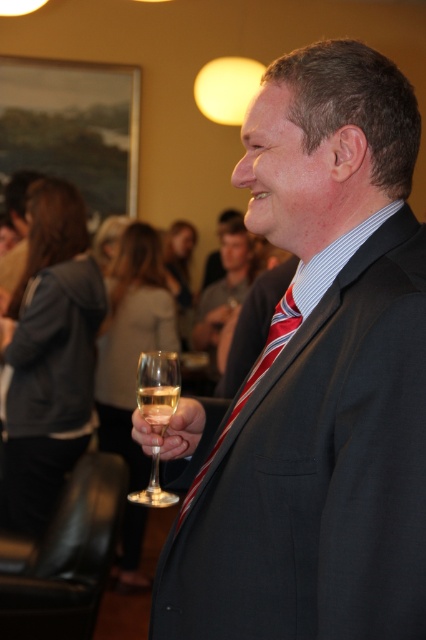
You are a photographer at the event. You want to take a photo of the matte black suit at center and the clear glass at center. Which object should you focus on if you want the one that takes up more space in the photo?

The matte black suit at center is larger in size than the clear glass at center, so you should focus on the matte black suit at center to capture it taking up more space in the photo.

You are at a formal event and need to place a decorative item exactly at the coordinates provided. Where should you place it relative to the clear glass wine glass at center?

The decorative item should be placed at the coordinates point (158, 387), which is the exact location of the clear glass wine glass at center.

You are a photographer at the event and want to ensure both the matte black suit at center and the striped fabric tie at center are clearly visible in your photo. Given that the camera can only focus on objects larger than 10 cm, will both items meet the focus requirement?

The matte black suit at center has a larger size compared to striped fabric tie at center. Since the camera requires objects larger than 10 cm to focus, and the matte black suit is larger, it will meet the requirement. However, the striped fabric tie at center may be smaller than 10 cm and might not meet the focus requirement.